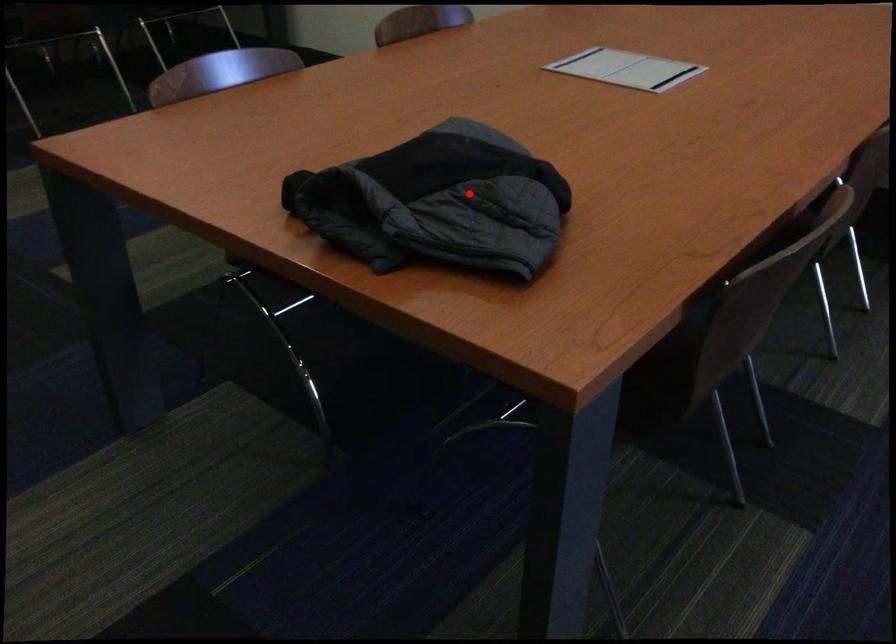
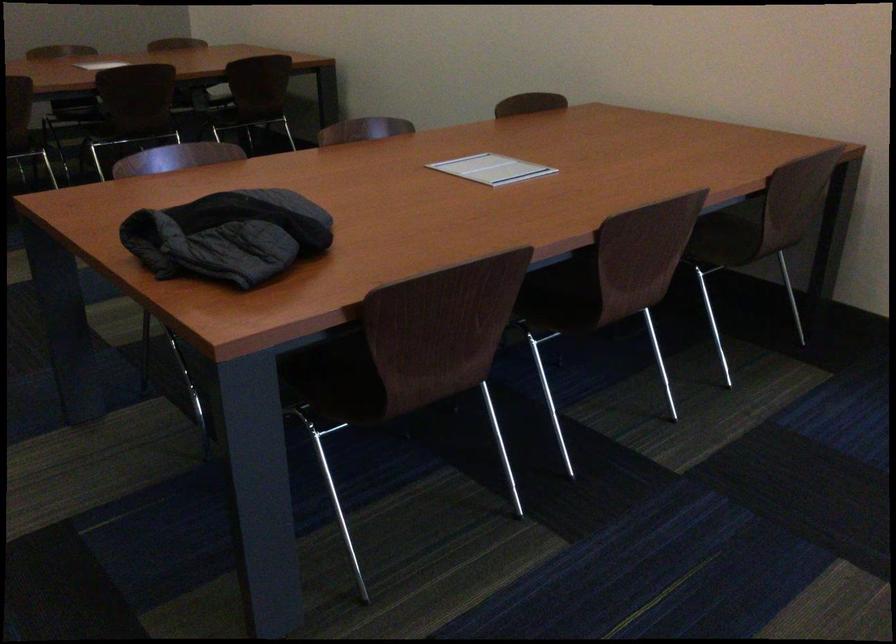
Question: I am providing you with two images of the same scene from different viewpoints. In image1, a red point is highlighted. Considering the same 3D point in image2, which of the following is correct?

Choices:
 (A) It is closer
 (B) It is farther

Answer: (B)